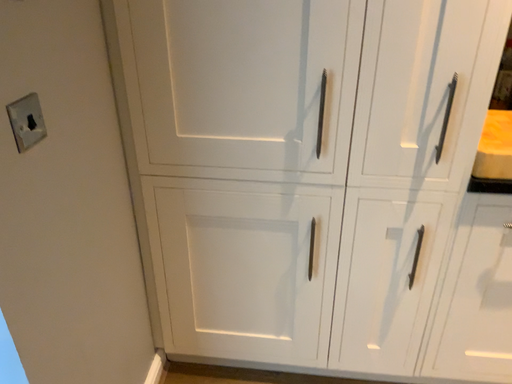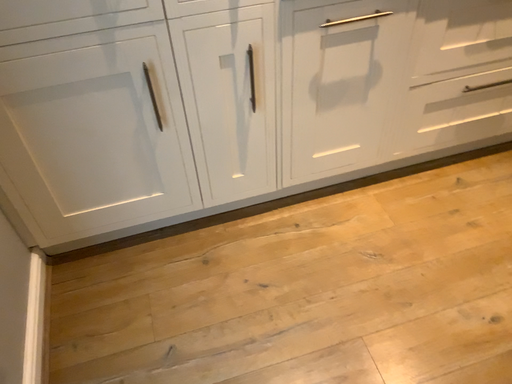
Question: How did the camera likely rotate when shooting the video?

Choices:
 (A) rotated right
 (B) rotated left

Answer: (A)